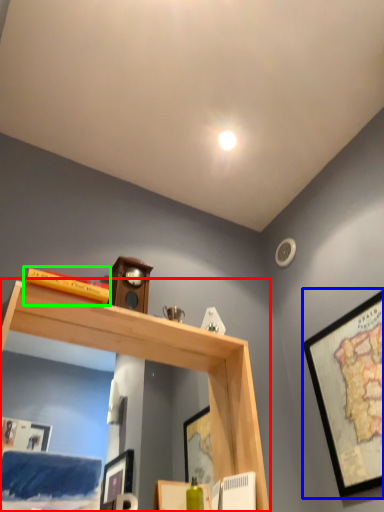
Question: Based on their relative distances, which object is nearer to shelf (highlighted by a red box)? Choose from picture frame (highlighted by a blue box) and book (highlighted by a green box).

Choices:
 (A) picture frame
 (B) book

Answer: (B)